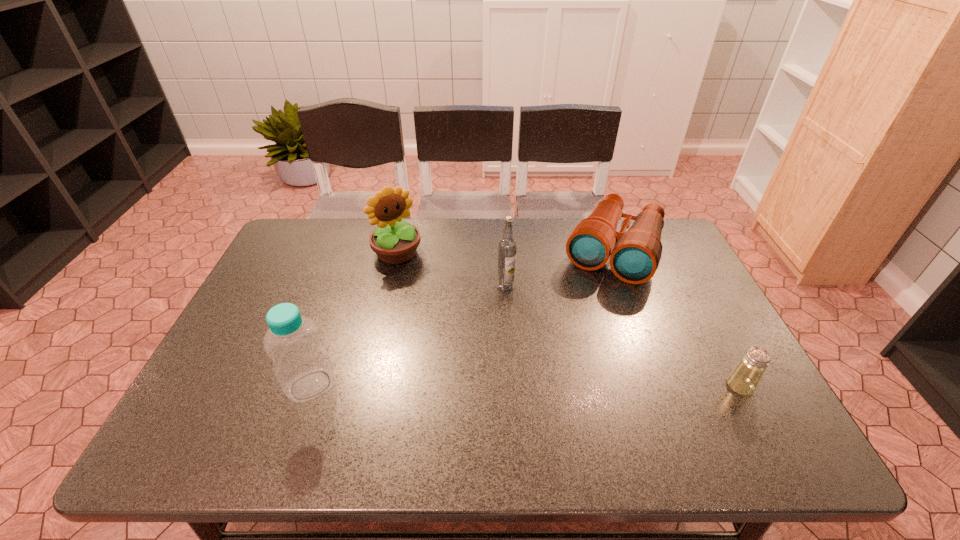
Image resolution: width=960 pixels, height=540 pixels. What are the coordinates of `the third closest object relative to the binoculars` in the screenshot? It's located at (394, 241).

Select which object is the second closest to the second shortest object. Please provide its 2D coordinates. Your answer should be formatted as a tuple, i.e. [(x, y)], where the tuple contains the x and y coordinates of a point satisfying the conditions above.

[(744, 379)]

At what (x,y) coordinates should I click in order to perform the action: click on vacant region that satisfies the following two spatial constraints: 1. on the front side of the bottle; 2. on the right side of the shortest object. Please return your answer as a coordinate pair (x, y). Looking at the image, I should click on (311, 386).

The height and width of the screenshot is (540, 960). Identify the location of vacant space that satisfies the following two spatial constraints: 1. on the front side of the bottle; 2. on the right side of the shortest object. (311, 386).